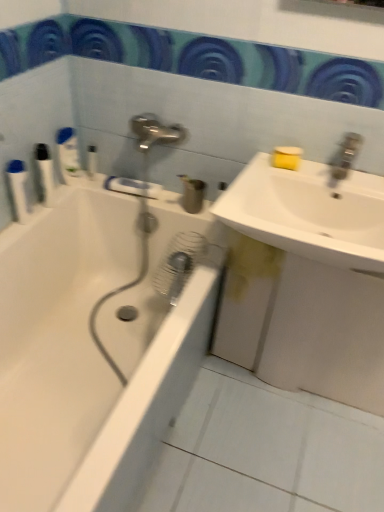
What are the coordinates of `vacant space behind white plastic bottles at left, the second toiletry viewed from the left` in the screenshot? It's located at (78, 186).